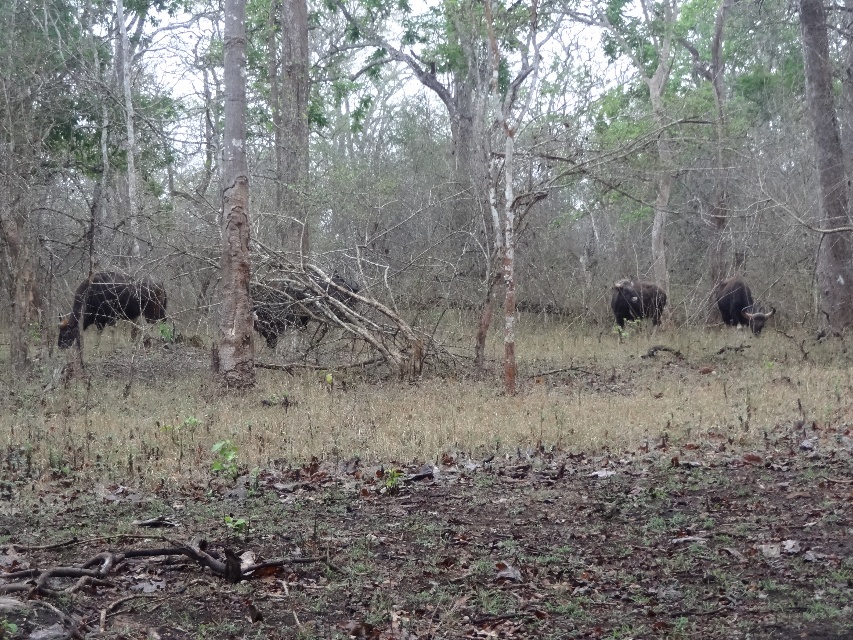
Does shiny black buffalo at left have a larger size compared to shiny black buffalo at center?

Indeed, shiny black buffalo at left has a larger size compared to shiny black buffalo at center.

Does shiny black buffalo at left appear on the right side of shiny black buffalo at center?

In fact, shiny black buffalo at left is to the left of shiny black buffalo at center.

Between point (148, 298) and point (656, 321), which one is positioned in front?

Point (148, 298) is in front.

I want to click on shiny black buffalo at left, so click(x=111, y=301).

Who is taller, black matte cow at center or shiny black buffalo at center?

shiny black buffalo at center

Who is positioned more to the left, black matte cow at center or shiny black buffalo at center?

black matte cow at center is more to the left.

Who is more forward, [256,314] or [648,312]?

Point [256,314] is more forward.

Locate an element on the screen. The height and width of the screenshot is (640, 853). black matte cow at center is located at coordinates (277, 308).

Is brown bark tree at center thinner than dark brown textured cow at right?

Incorrect, brown bark tree at center's width is not less than dark brown textured cow at right's.

Is point (427, 160) closer to camera compared to point (734, 288)?

No, it is behind (734, 288).

Who is more distant from viewer, [244,86] or [722,300]?

The point [722,300] is more distant.

This screenshot has width=853, height=640. Find the location of `brown bark tree at center`. brown bark tree at center is located at coordinates (424, 163).